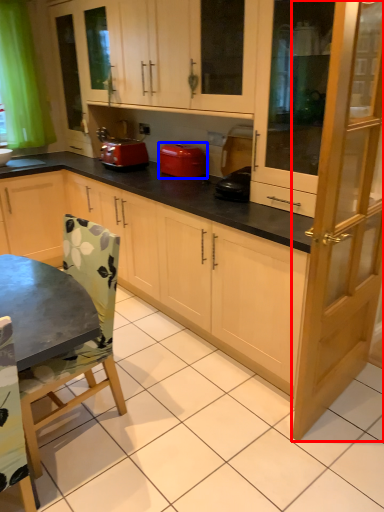
Question: Among these objects, which one is farthest to the camera, screen door (highlighted by a red box) or home appliance (highlighted by a blue box)?

Choices:
 (A) screen door
 (B) home appliance

Answer: (B)